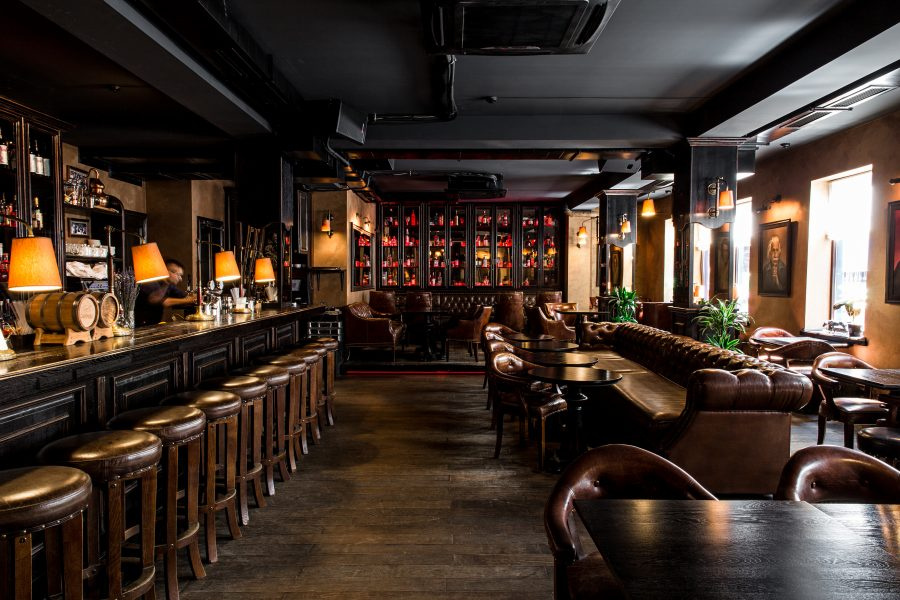
You are a GUI agent. You are given a task and a screenshot of the screen. Output one action in this format:
    pyautogui.click(x=<x>, y=<y>)
    Task: Click on the barstools
    
    Given the screenshot: What is the action you would take?
    pyautogui.click(x=329, y=344), pyautogui.click(x=319, y=352), pyautogui.click(x=310, y=361), pyautogui.click(x=295, y=365), pyautogui.click(x=277, y=374), pyautogui.click(x=253, y=383), pyautogui.click(x=226, y=405), pyautogui.click(x=184, y=425), pyautogui.click(x=136, y=446), pyautogui.click(x=68, y=497)